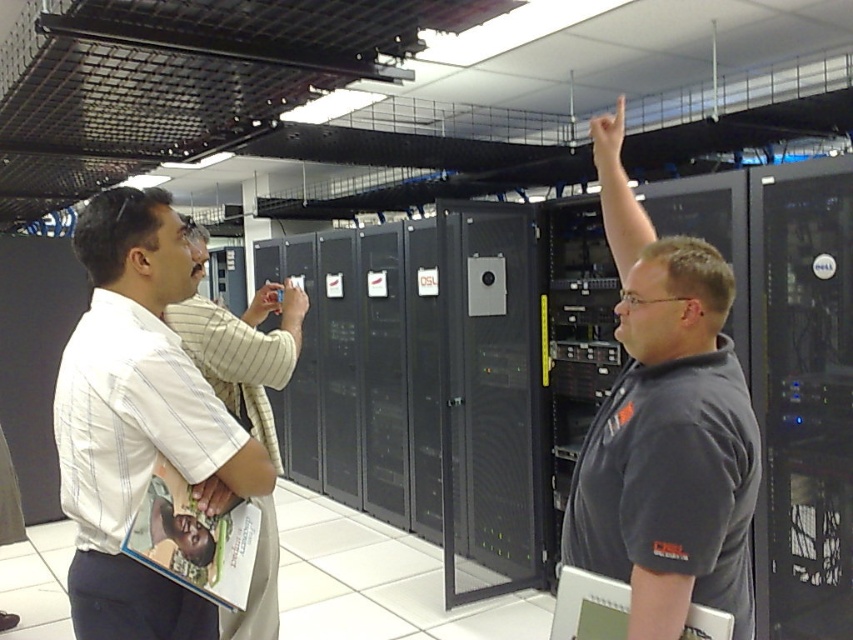
Looking at this image, you are a security guard in the server room. You notice two people wearing dark gray shirt at center and white striped shirt at center. Which one has a narrower body width?

The dark gray shirt at center has a narrower body width than the white striped shirt at center according to the description.

You are standing in a server room and see a person wearing a white striped shirt at left. If you want to approach them without moving past the server racks, can you reach them within 2 meters?

The distance between you and the white striped shirt at left is 1.44 meters, so yes, you can reach them within 2 meters without moving past the server racks.

You are a technician in the server room. You need to move from your current position at point (x=68, y=490) to the server rack labeled 10B. However, there is a technician standing 1.55 meters away from you. Can you safely walk around them to reach the server rack without getting too close?

The technician is 1.55 meters away from you. Since the minimum safe distance is typically 1 meter, you can safely walk around them to reach the server rack labeled 10B without getting too close.